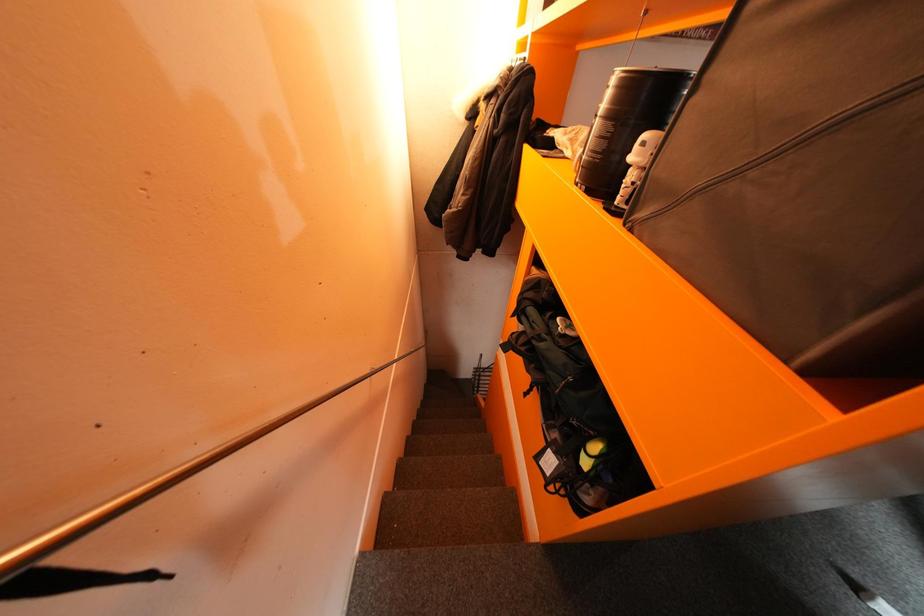
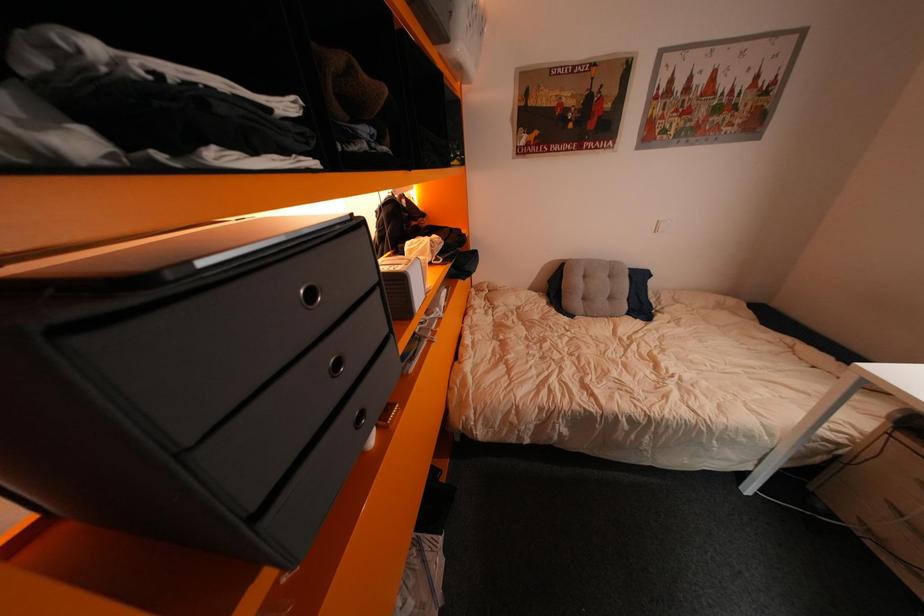
Question: Based on the continuous images, in which direction is the camera rotating? Reply with the corresponding letter.

Choices:
 (A) Left
 (B) Right
 (C) Up
 (D) Down

Answer: (C)